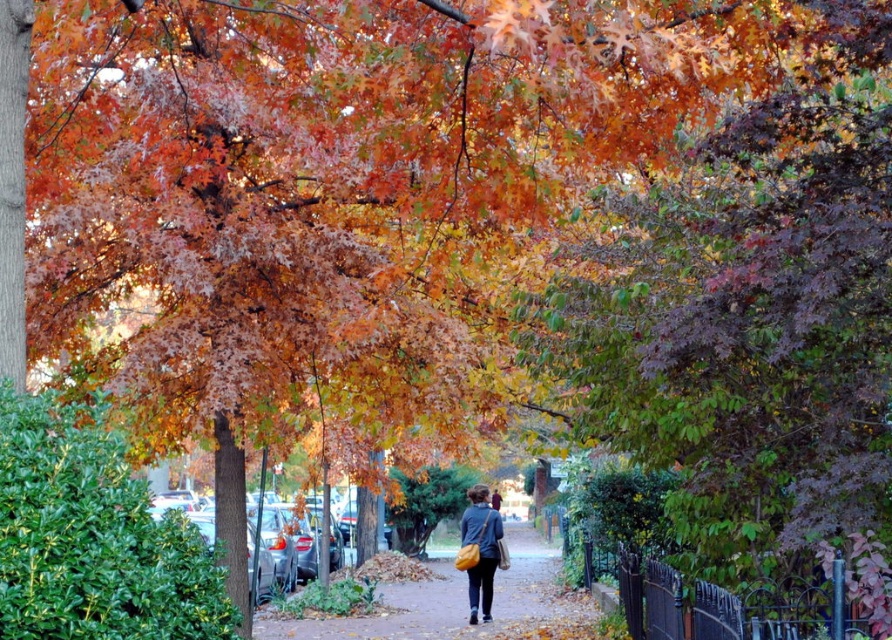
You are a photographer trying to capture the autumn scene. You want to ensure that both the brown textured sidewalk at center and the matte yellow bag at center are visible in your shot. Based on their positions, which object should you frame first to include both in the composition?

The brown textured sidewalk at center is positioned on the left side of the matte yellow bag at center, so you should frame the brown textured sidewalk at center first to ensure both objects are included in the composition.

You are standing at the camera position looking at the scene. Where is the brown textured sidewalk at center located in the image?

The brown textured sidewalk at center is located at the 2D coordinates point (455, 602) in the image.

You are standing on the sidewalk and looking at the brown textured sidewalk at center and the matte yellow bag at center. Which object is closer to the ground?

The brown textured sidewalk at center is positioned under the matte yellow bag at center, so the brown textured sidewalk at center is closer to the ground.